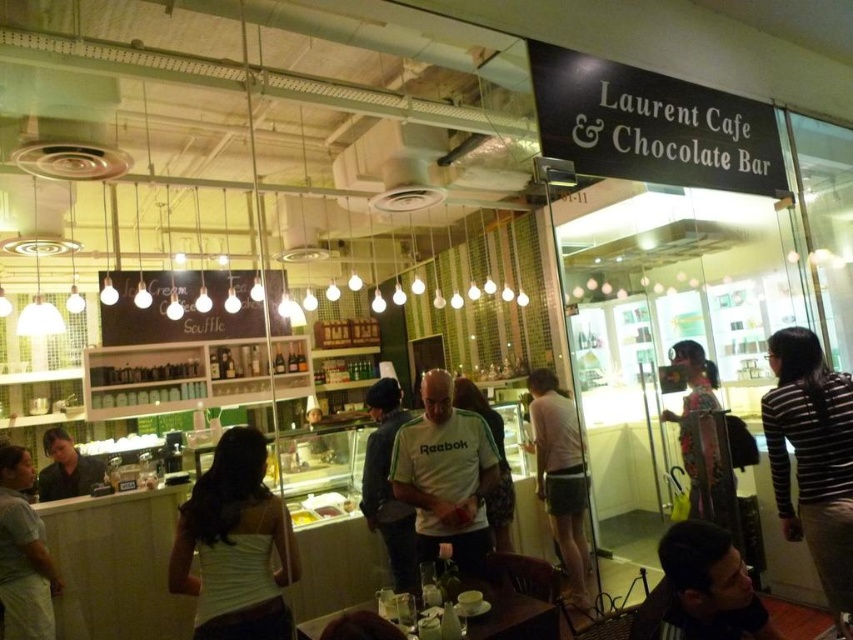
You are a customer at Laurent Cafe and want to grab both the white fabric tank top at center and the white reebok shirt at center from the counter. Which item should you reach for first to get the one closer to you?

The white fabric tank top at center is closer to the viewer than the white reebok shirt at center, so you should reach for the white fabric tank top at center first.

You are a customer at Laurent Cafe and want to place your coat on the chair between the white fabric tank top at center and the striped sweater at right. Is there enough space between them to accommodate your coat?

The distance between the white fabric tank top at center and the striped sweater at right is 7.99 feet, which is more than enough space to place your coat between them.